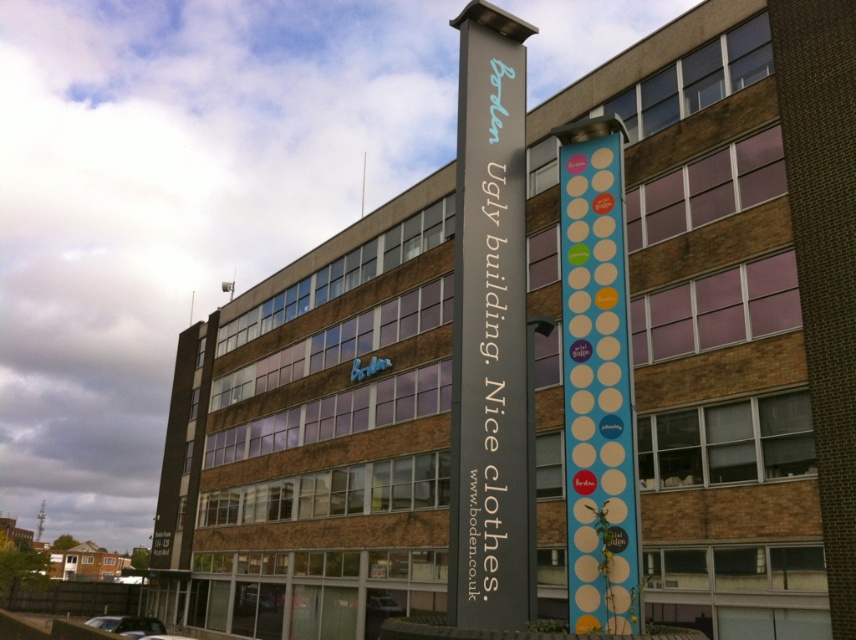
Question: Is the position of dark gray signpost at center less distant than that of blue polka dot sign at center?

Choices:
 (A) no
 (B) yes

Answer: (A)

Question: Which object is closer to the camera taking this photo?

Choices:
 (A) blue polka dot sign at center
 (B) dark gray signpost at center

Answer: (A)

Question: Can you confirm if dark gray signpost at center is thinner than blue polka dot sign at center?

Choices:
 (A) yes
 (B) no

Answer: (B)

Question: Is dark gray signpost at center positioned at the back of blue polka dot sign at center?

Choices:
 (A) no
 (B) yes

Answer: (B)